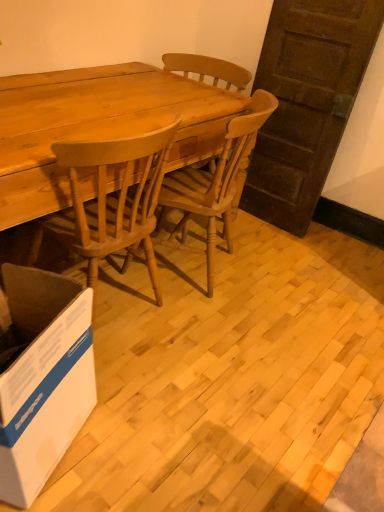
Question: Is light brown wood chair at center far from light brown wood desk at center?

Choices:
 (A) yes
 (B) no

Answer: (B)

Question: Is light brown wood desk at center at the back of light brown wood chair at center?

Choices:
 (A) yes
 (B) no

Answer: (A)

Question: Does light brown wood chair at center turn towards light brown wood desk at center?

Choices:
 (A) yes
 (B) no

Answer: (A)

Question: From the image's perspective, is light brown wood chair at center on light brown wood desk at center?

Choices:
 (A) no
 (B) yes

Answer: (A)

Question: Can you confirm if light brown wood chair at center is wider than light brown wood desk at center?

Choices:
 (A) no
 (B) yes

Answer: (A)

Question: In the image, is light brown wood desk at center on the left side or the right side of white cardboard box at lower left?

Choices:
 (A) right
 (B) left

Answer: (A)

Question: Is point (105, 110) positioned closer to the camera than point (39, 279)?

Choices:
 (A) farther
 (B) closer

Answer: (A)

Question: Considering the positions of light brown wood desk at center and white cardboard box at lower left in the image, is light brown wood desk at center wider or thinner than white cardboard box at lower left?

Choices:
 (A) thin
 (B) wide

Answer: (B)

Question: Based on their sizes in the image, would you say light brown wood desk at center is bigger or smaller than white cardboard box at lower left?

Choices:
 (A) big
 (B) small

Answer: (A)

Question: Is light brown wood desk at center in front of or behind light brown wood chair at center in the image?

Choices:
 (A) front
 (B) behind

Answer: (A)

Question: Is light brown wood desk at center inside or outside of light brown wood chair at center?

Choices:
 (A) inside
 (B) outside

Answer: (B)

Question: In the image, is light brown wood desk at center on the left side or the right side of light brown wood chair at center?

Choices:
 (A) left
 (B) right

Answer: (A)

Question: From the image's perspective, is light brown wood desk at center above or below light brown wood chair at center?

Choices:
 (A) above
 (B) below

Answer: (A)

Question: Is light brown wood chair at center taller or shorter than white cardboard box at lower left?

Choices:
 (A) tall
 (B) short

Answer: (A)

Question: From a real-world perspective, is light brown wood chair at center above or below white cardboard box at lower left?

Choices:
 (A) above
 (B) below

Answer: (A)